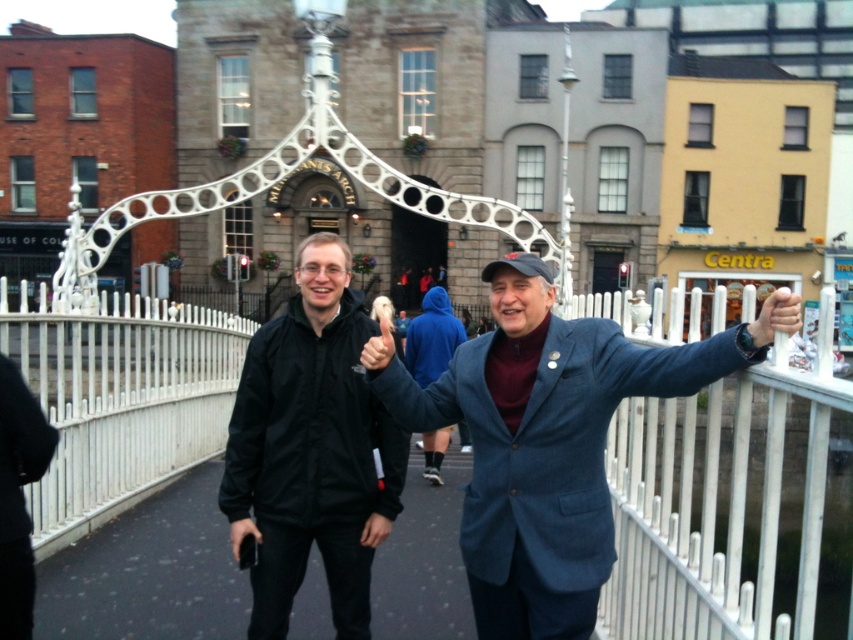
You are standing on the pedestrian bridge and want to take a photo of the white metal railing at right. According to the scene description, where should you position yourself to capture the railing in your shot?

The white metal railing at right is located at point (730, 508), so you should position yourself facing that coordinate to include the railing in your photo.

You are standing on the white metal bridge at center and want to wave to the person wearing the black matte jacket at center. In which direction should you turn to face them?

The black matte jacket at center is positioned on the right side of the white metal bridge at center, so you should turn to your right to face them.